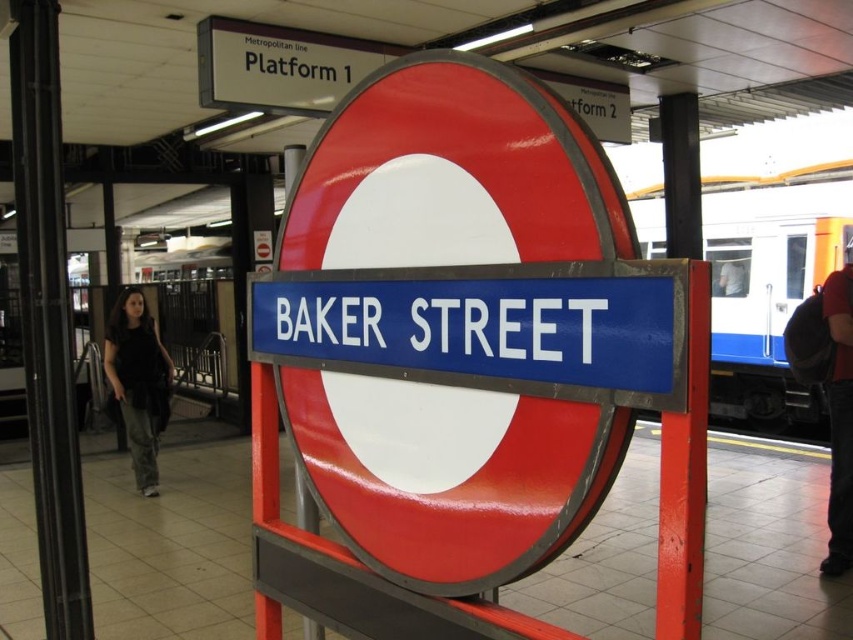
Question: Can you confirm if red fabric shirt at right is wider than dark hair at center?

Choices:
 (A) yes
 (B) no

Answer: (A)

Question: Based on their relative distances, which object is nearer to the metallic red circle at center?

Choices:
 (A) blue metallic train at right
 (B) dark gray pants at left
 (C) dark hair at center
 (D) red fabric shirt at right

Answer: (D)

Question: In this image, where is blue metallic train at right located relative to dark gray pants at left?

Choices:
 (A) right
 (B) left

Answer: (A)

Question: Can you confirm if blue metallic train at right is thinner than dark hair at center?

Choices:
 (A) no
 (B) yes

Answer: (A)

Question: Which point is closer to the camera taking this photo?

Choices:
 (A) (720, 253)
 (B) (838, 486)
 (C) (149, 388)

Answer: (B)

Question: Which of the following is the farthest from the observer?

Choices:
 (A) (631, 200)
 (B) (849, 365)
 (C) (136, 429)

Answer: (A)